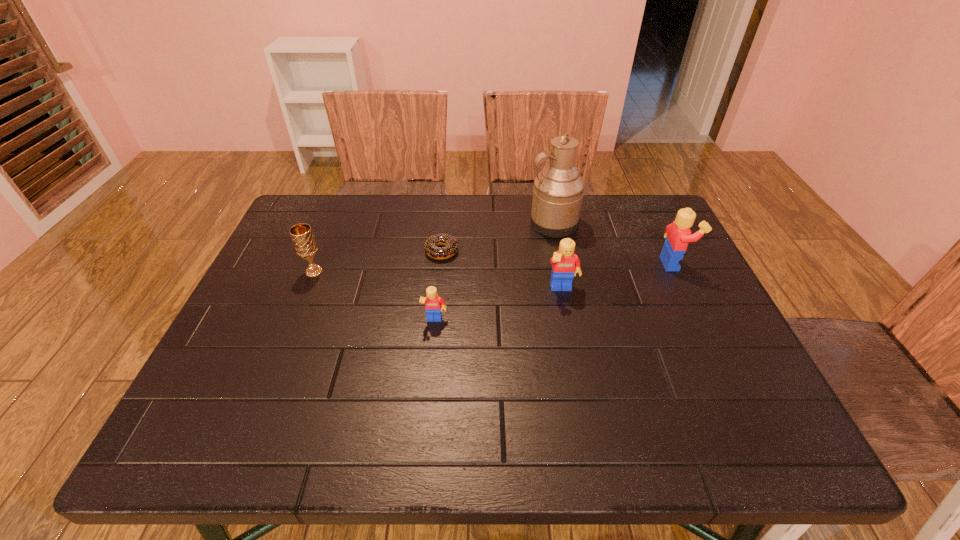
The height and width of the screenshot is (540, 960). I want to click on free area in between the farthest object and the doughnut, so click(497, 237).

This screenshot has height=540, width=960. Identify the location of vacant point located between the chalice and the doughnut. (378, 261).

Find the location of a particular element. empty space that is in between the leftmost object and the rightmost Lego is located at coordinates (493, 267).

Find the location of `object that is the fifth closest one to the chalice`. object that is the fifth closest one to the chalice is located at coordinates (678, 234).

Identify which object is the second closest to the pitcher. Please provide its 2D coordinates. Your answer should be formatted as a tuple, i.e. [(x, y)], where the tuple contains the x and y coordinates of a point satisfying the conditions above.

[(678, 234)]

Locate which Lego is the third closest to the shortest object. Please provide its 2D coordinates. Your answer should be formatted as a tuple, i.e. [(x, y)], where the tuple contains the x and y coordinates of a point satisfying the conditions above.

[(678, 234)]

Find the location of a particular element. the second closest Lego to the tallest object is located at coordinates (678, 234).

Identify the location of free space that satisfies the following two spatial constraints: 1. on the face of the rightmost Lego; 2. on the front side of the leftmost object. This screenshot has width=960, height=540. (678, 272).

Locate an element on the screen. vacant space that satisfies the following two spatial constraints: 1. on the face of the rightmost Lego; 2. on the face of the nearest Lego is located at coordinates (702, 321).

You are a GUI agent. You are given a task and a screenshot of the screen. Output one action in this format:
    pyautogui.click(x=<x>, y=<y>)
    Task: Click on the vacant space that satisfies the following two spatial constraints: 1. on the face of the farthest Lego; 2. on the face of the shortest Lego
    This screenshot has height=540, width=960.
    Given the screenshot: What is the action you would take?
    pyautogui.click(x=702, y=321)